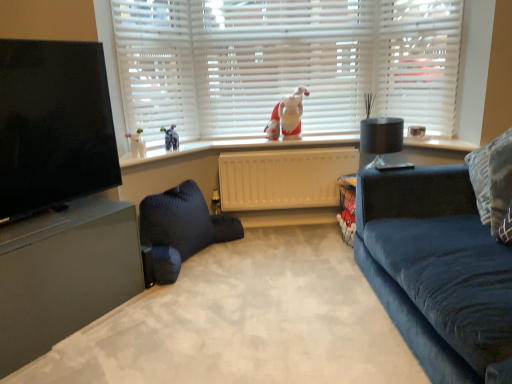
Identify the location of vacant area that is situated to the right of matte gray entertainment center at left. (161, 321).